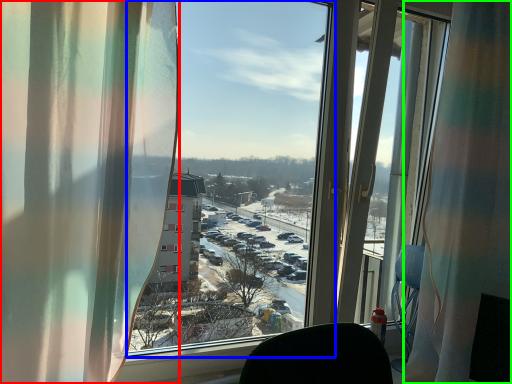
Question: Considering the real-world distances, which object is farthest from curtain (highlighted by a red box)? window screen (highlighted by a blue box) or curtain (highlighted by a green box)?

Choices:
 (A) window screen
 (B) curtain

Answer: (A)